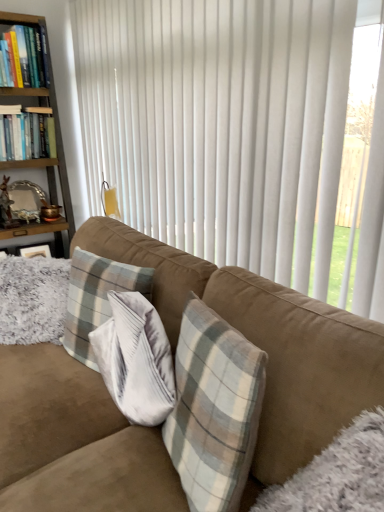
Question: Is plaid fabric pillow at center a part of wooden bookshelf at left?

Choices:
 (A) yes
 (B) no

Answer: (B)

Question: Can you see wooden bookshelf at left touching plaid fabric pillow at center?

Choices:
 (A) yes
 (B) no

Answer: (B)

Question: From the image's perspective, does wooden bookshelf at left appear higher than plaid fabric pillow at center?

Choices:
 (A) no
 (B) yes

Answer: (B)

Question: Is wooden bookshelf at left looking in the opposite direction of plaid fabric pillow at center?

Choices:
 (A) yes
 (B) no

Answer: (B)

Question: Can you confirm if wooden bookshelf at left is positioned to the right of plaid fabric pillow at center?

Choices:
 (A) yes
 (B) no

Answer: (B)

Question: Are wooden bookshelf at left and plaid fabric pillow at center located far from each other?

Choices:
 (A) yes
 (B) no

Answer: (A)

Question: Can you confirm if wooden bookshelf at left is smaller than hardcover books at left, the second book when ordered from top to bottom?

Choices:
 (A) no
 (B) yes

Answer: (A)

Question: From a real-world perspective, does wooden bookshelf at left stand above hardcover books at left, the second book when ordered from top to bottom?

Choices:
 (A) no
 (B) yes

Answer: (A)

Question: Is wooden bookshelf at left far from hardcover books at left, which appears as the first book when ordered from the bottom?

Choices:
 (A) no
 (B) yes

Answer: (A)

Question: Is hardcover books at left, the second book when ordered from top to bottom, at the back of wooden bookshelf at left?

Choices:
 (A) yes
 (B) no

Answer: (A)

Question: Does wooden bookshelf at left have a lesser height compared to hardcover books at left, the second book when ordered from top to bottom?

Choices:
 (A) no
 (B) yes

Answer: (A)

Question: Considering the relative sizes of wooden bookshelf at left and hardcover books at left, the second book when ordered from top to bottom, in the image provided, is wooden bookshelf at left wider than hardcover books at left, the second book when ordered from top to bottom,?

Choices:
 (A) no
 (B) yes

Answer: (B)

Question: Is hardcover books at left, which appears as the first book when ordered from the bottom, surrounded by hardcover book at upper left, the 1th book when ordered from top to bottom?

Choices:
 (A) yes
 (B) no

Answer: (B)